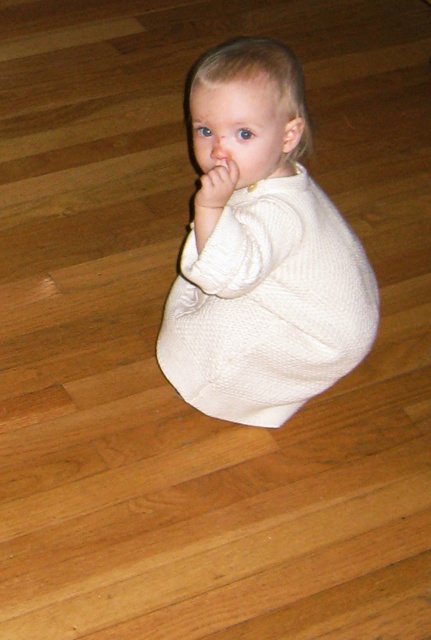
Question: Does white knitted sweater at center have a greater width compared to smooth cream skin at center?

Choices:
 (A) no
 (B) yes

Answer: (B)

Question: Is white knitted sweater at center smaller than smooth cream skin at center?

Choices:
 (A) yes
 (B) no

Answer: (B)

Question: Which point appears farthest from the camera in this image?

Choices:
 (A) (255, 221)
 (B) (214, 200)
 (C) (208, 188)

Answer: (A)

Question: Which point is farther to the camera?

Choices:
 (A) (236, 168)
 (B) (224, 138)

Answer: (B)

Question: Estimate the real-world distances between objects in this image. Which object is farther from the white matte hand at center?

Choices:
 (A) white knitted sweater at center
 (B) smooth cream skin at center

Answer: (A)

Question: Is white knitted sweater at center positioned in front of white matte hand at center?

Choices:
 (A) yes
 (B) no

Answer: (A)